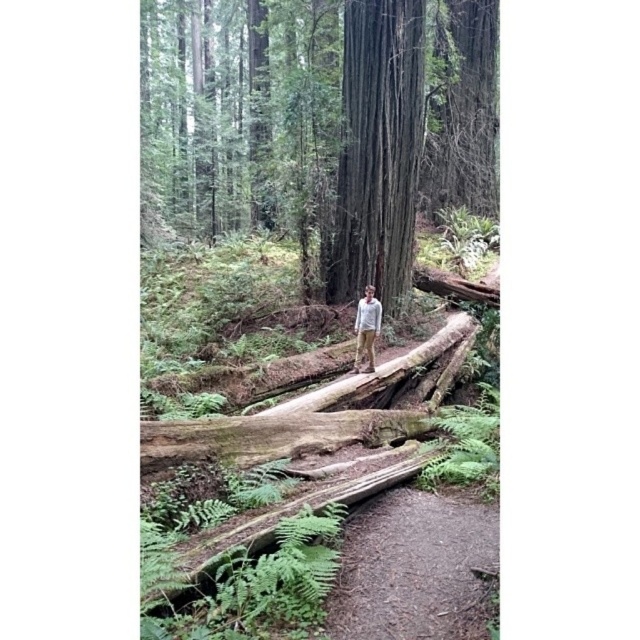
Between point (340, 154) and point (368, 326), which one is positioned behind?

Positioned behind is point (340, 154).

Does smooth brown trunk at center have a larger size compared to light gray sweater at center?

Correct, smooth brown trunk at center is larger in size than light gray sweater at center.

Identify the location of smooth brown trunk at center. The width and height of the screenshot is (640, 640). (316, 125).

Is smooth brown trunk at center to the right of brown dirt path at lower center from the viewer's perspective?

No, smooth brown trunk at center is not to the right of brown dirt path at lower center.

Which is in front, point (316, 109) or point (339, 600)?

Positioned in front is point (339, 600).

Find the location of `smooth brown trunk at center`. smooth brown trunk at center is located at coordinates (316, 125).

Can you confirm if smooth brown trunk at center is positioned below smooth dark brown tree trunk at center?

No, smooth brown trunk at center is not below smooth dark brown tree trunk at center.

The height and width of the screenshot is (640, 640). Describe the element at coordinates (316, 125) in the screenshot. I see `smooth brown trunk at center` at that location.

This screenshot has width=640, height=640. I want to click on smooth brown trunk at center, so click(x=316, y=125).